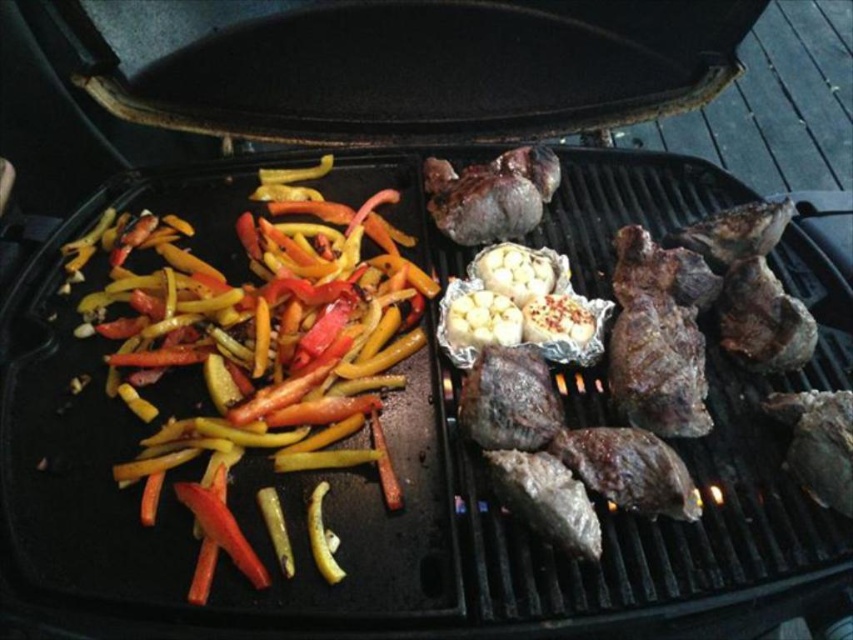
Which is in front, point (225, 342) or point (619, 230)?

Point (225, 342)

Does shiny yellow-green bell peppers at left have a larger size compared to charred brown meat at right?

Yes, shiny yellow-green bell peppers at left is bigger than charred brown meat at right.

Between point (177, 266) and point (686, 346), which one is positioned behind?

Point (177, 266)

Where is `shiny yellow-green bell peppers at left`? Image resolution: width=853 pixels, height=640 pixels. shiny yellow-green bell peppers at left is located at coordinates (258, 333).